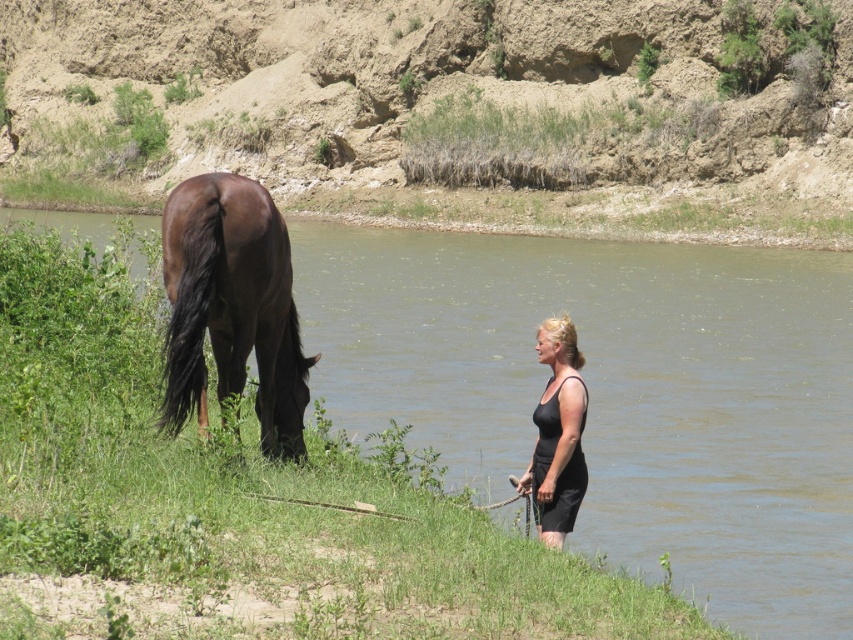
Question: Does dull brown dirt at upper left have a greater width compared to black matte dress at lower right?

Choices:
 (A) no
 (B) yes

Answer: (B)

Question: Where is dull brown dirt at upper left located in relation to shiny dark brown horse at left in the image?

Choices:
 (A) below
 (B) above

Answer: (B)

Question: Which of the following is the farthest from the observer?

Choices:
 (A) dull brown dirt at upper left
 (B) green grass at lower left
 (C) shiny dark brown horse at left

Answer: (A)

Question: Among these objects, which one is farthest from the camera?

Choices:
 (A) dull brown dirt at upper left
 (B) green grass at lower left

Answer: (A)

Question: Is green grass at lower left closer to camera compared to black matte dress at lower right?

Choices:
 (A) no
 (B) yes

Answer: (B)

Question: Which object is closer to the camera taking this photo?

Choices:
 (A) shiny dark brown horse at left
 (B) green grass at lower left
 (C) dull brown dirt at upper left

Answer: (B)